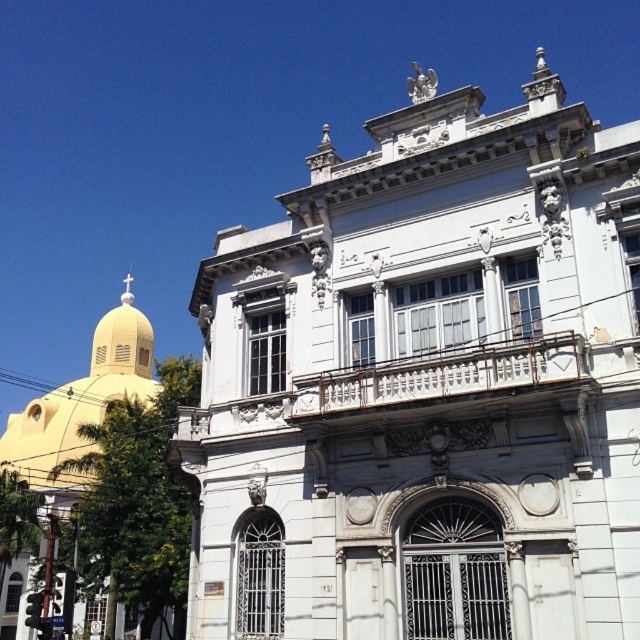
You are an architect analyzing the spatial arrangement of two buildings in the image. The buildings are the matte yellow dome at upper left and the matte yellow dome at left. Which of these two buildings is located higher up in the image?

The matte yellow dome at upper left is positioned over the matte yellow dome at left, meaning it is higher up in the image.

Consider the image. You are standing in the middle of the scene and want to determine which of the two points, point (620, 324) or point (97, 380), is closer to you. Based on the given information, which point is nearer?

Point (620, 324) is closer to the viewer than point (97, 380).